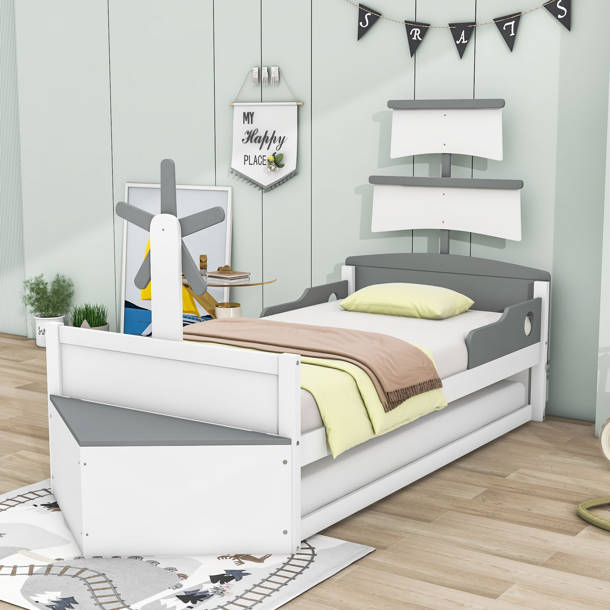
You are a GUI agent. You are given a task and a screenshot of the screen. Output one action in this format:
    pyautogui.click(x=<x>, y=<y>)
    Task: Click on the mattress
    The height and width of the screenshot is (610, 610).
    Given the screenshot: What is the action you would take?
    pyautogui.click(x=446, y=339), pyautogui.click(x=412, y=435)